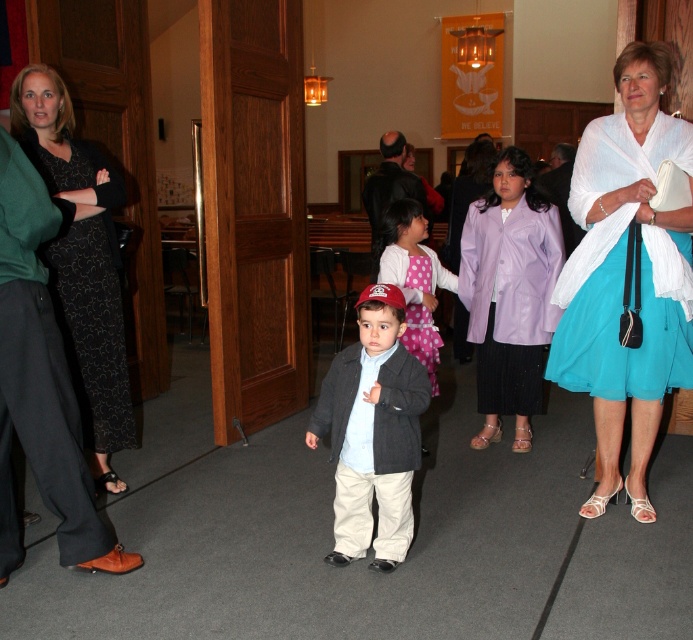
Based on the scene description, which object is positioned higher in the image, the lavender satin blazer at center or the black printed fabric dress at left?

The lavender satin blazer at center is positioned higher than the black printed fabric dress at left in the image.

Where is the matte gray jacket at center located in the image?

The matte gray jacket at center is located at point 0.677 on the x axis and 0.538 on the y axis.

You are a photographer standing at the entrance of the hall. You need to take a photo of the lavender satin blazer at center and the young boy wearing a red baseball cap. How far apart are these two subjects?

The lavender satin blazer at center and the young boy wearing a red baseball cap are 3.33 meters apart.